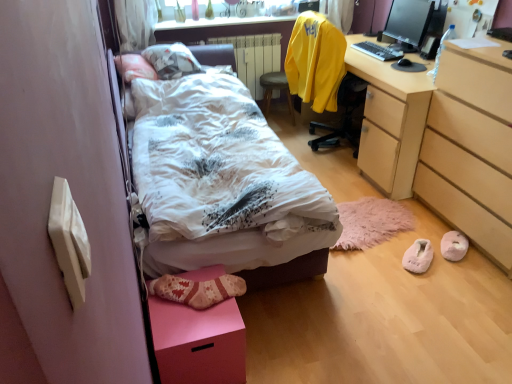
Where is `empty space that is ontop of white painted metal radiator at center (from a real-world perspective)`? empty space that is ontop of white painted metal radiator at center (from a real-world perspective) is located at coordinates (240, 30).